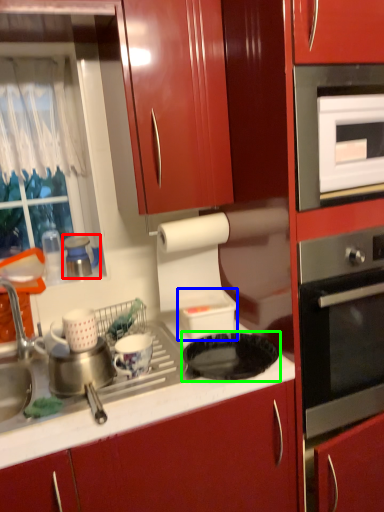
Question: Estimate the real-world distances between objects in this image. Which object is farther from appliance (highlighted by a red box), appliance (highlighted by a blue box) or gas stove (highlighted by a green box)?

Choices:
 (A) appliance
 (B) gas stove

Answer: (B)